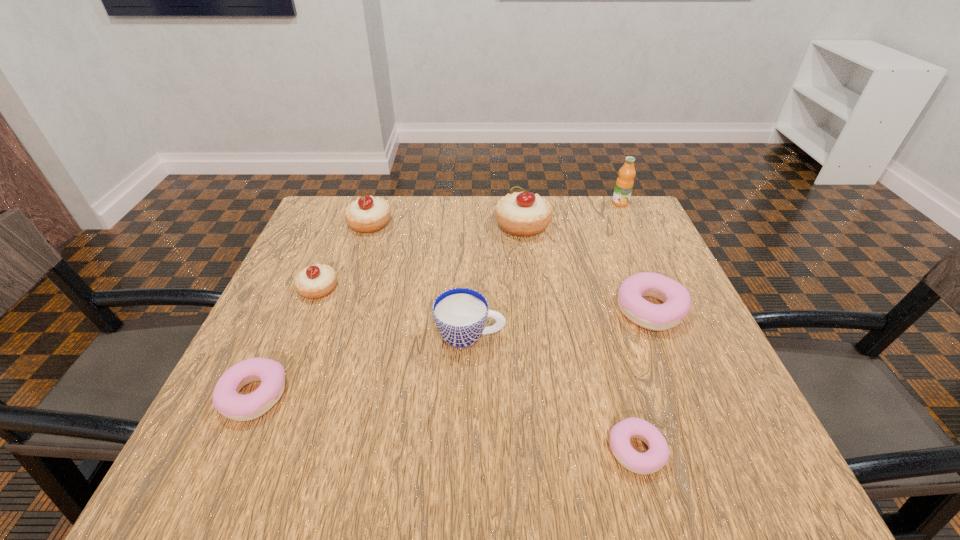
Identify which pink pastry is the closest to the third shortest object. Please provide its 2D coordinates. Your answer should be formatted as a tuple, i.e. [(x, y)], where the tuple contains the x and y coordinates of a point satisfying the conditions above.

[(651, 461)]

Identify the location of free location that satisfies the following two spatial constraints: 1. on the side of the cup with the handle; 2. on the right side of the smallest pink pastry. (468, 450).

At what (x,y) coordinates should I click in order to perform the action: click on free space that satisfies the following two spatial constraints: 1. on the front side of the rightmost beige pastry; 2. on the right side of the second tallest pastry. Please return your answer as a coordinate pair (x, y). Looking at the image, I should click on (370, 225).

You are a GUI agent. You are given a task and a screenshot of the screen. Output one action in this format:
    pyautogui.click(x=<x>, y=<y>)
    Task: Click on the free space that satisfies the following two spatial constraints: 1. on the back side of the fifth tallest pastry; 2. on the left side of the smallest beige pastry
    
    Given the screenshot: What is the action you would take?
    pyautogui.click(x=302, y=289)

The width and height of the screenshot is (960, 540). I want to click on free space in the image that satisfies the following two spatial constraints: 1. on the label of the tallest object; 2. on the side of the cup with the handle, so click(x=680, y=336).

Find the location of a particular element. free location that satisfies the following two spatial constraints: 1. on the front side of the farthest pink pastry; 2. on the side of the cup with the handle is located at coordinates (661, 336).

I want to click on free spot that satisfies the following two spatial constraints: 1. on the back side of the third shortest pastry; 2. on the left side of the second smallest pink pastry, so click(293, 309).